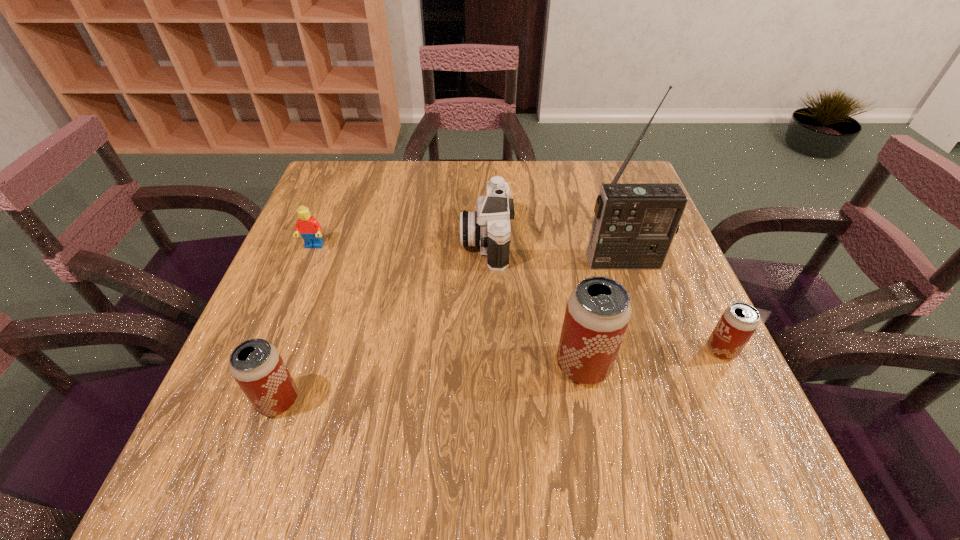
You are a GUI agent. You are given a task and a screenshot of the screen. Output one action in this format:
    pyautogui.click(x=<x>, y=<y>)
    Task: Click on the vacant space that's between the Lego and the leftmost beer can
    This screenshot has height=540, width=960.
    Given the screenshot: What is the action you would take?
    pyautogui.click(x=297, y=323)

This screenshot has height=540, width=960. Find the location of `empty space that is in between the tallest beer can and the Lego`. empty space that is in between the tallest beer can and the Lego is located at coordinates (448, 306).

Locate an element on the screen. This screenshot has height=540, width=960. vacant space that is in between the shortest beer can and the Lego is located at coordinates (517, 298).

Where is `empty space that is in between the leftmost beer can and the Lego`? empty space that is in between the leftmost beer can and the Lego is located at coordinates (297, 323).

Identify the location of object that is the second closest to the Lego. This screenshot has width=960, height=540. (256, 365).

Identify which object is the fourth nearest to the second beer can from left to right. Please provide its 2D coordinates. Your answer should be formatted as a tuple, i.e. [(x, y)], where the tuple contains the x and y coordinates of a point satisfying the conditions above.

[(256, 365)]

Identify which beer can is the second closest to the second tallest object. Please provide its 2D coordinates. Your answer should be formatted as a tuple, i.e. [(x, y)], where the tuple contains the x and y coordinates of a point satisfying the conditions above.

[(256, 365)]

Identify the location of beer can that can be found as the second closest to the second object from right to left. (598, 311).

I want to click on free spot that satisfies the following two spatial constraints: 1. on the face of the second shortest beer can; 2. on the left side of the Lego, so click(252, 401).

Where is `free point that satisfies the following two spatial constraints: 1. on the back side of the second tallest object; 2. on the right side of the second shortest beer can`? This screenshot has width=960, height=540. free point that satisfies the following two spatial constraints: 1. on the back side of the second tallest object; 2. on the right side of the second shortest beer can is located at coordinates (291, 366).